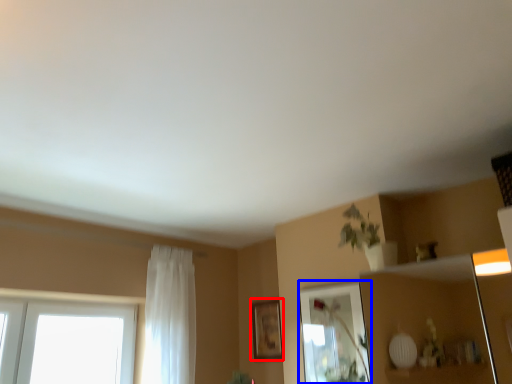
Question: Which point is closer to the camera, picture frame (highlighted by a red box) or mirror (highlighted by a blue box)?

Choices:
 (A) picture frame
 (B) mirror

Answer: (B)